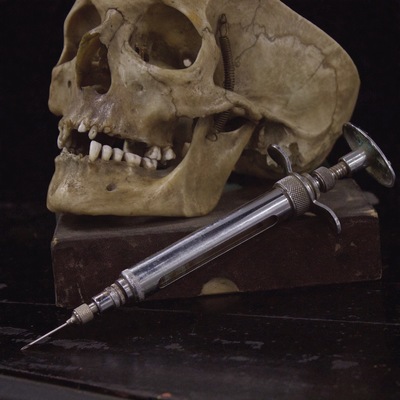
Where is `handle`? The width and height of the screenshot is (400, 400). handle is located at coordinates (332, 209).